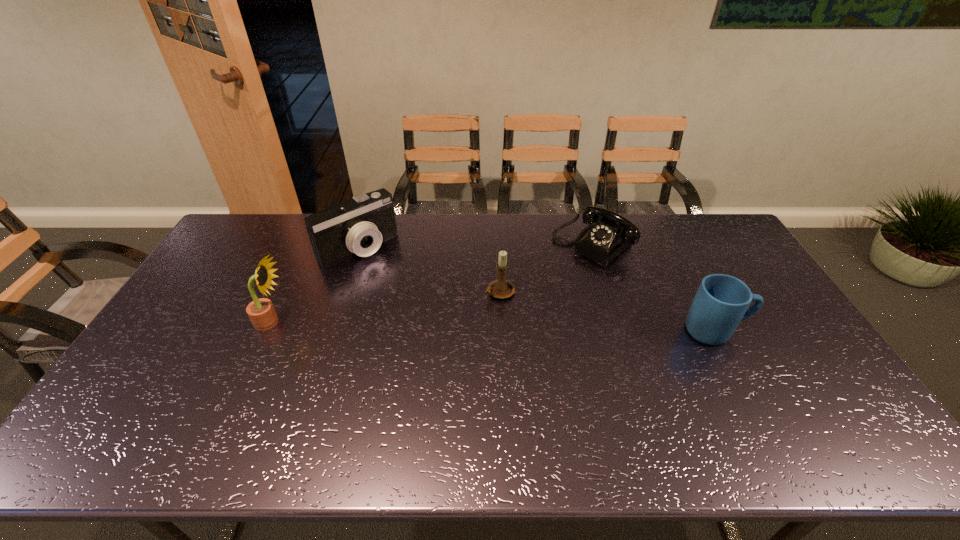
Identify the location of the tallest object. (261, 312).

Find the location of `sunflower`. sunflower is located at coordinates (261, 312).

Locate an element on the screen. The width and height of the screenshot is (960, 540). the rightmost object is located at coordinates (721, 302).

The image size is (960, 540). I want to click on the shortest object, so click(612, 233).

Where is `telephone`? This screenshot has height=540, width=960. telephone is located at coordinates (612, 233).

I want to click on the third nearest object, so click(501, 288).

This screenshot has height=540, width=960. In order to click on candle holder in this screenshot , I will do `click(501, 288)`.

I want to click on the fourth object from right to left, so pyautogui.click(x=359, y=225).

Identify the location of vacant region located 0.150m on the face of the tallest object. This screenshot has height=540, width=960. [339, 322].

This screenshot has height=540, width=960. In order to click on blank space located 0.150m on the side of the mug with the handle in this screenshot , I will do `click(798, 331)`.